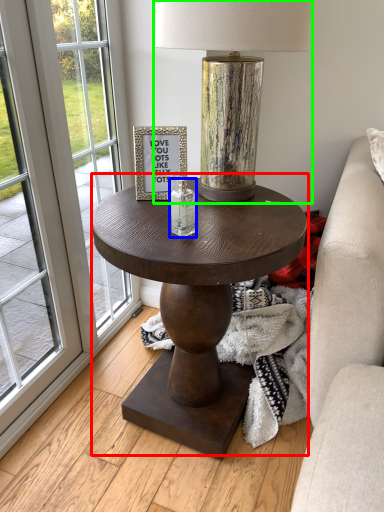
Question: Estimate the real-world distances between objects in this image. Which object is farther from coffee table (highlighted by a red box), candle holder (highlighted by a blue box) or lamp (highlighted by a green box)?

Choices:
 (A) candle holder
 (B) lamp

Answer: (B)